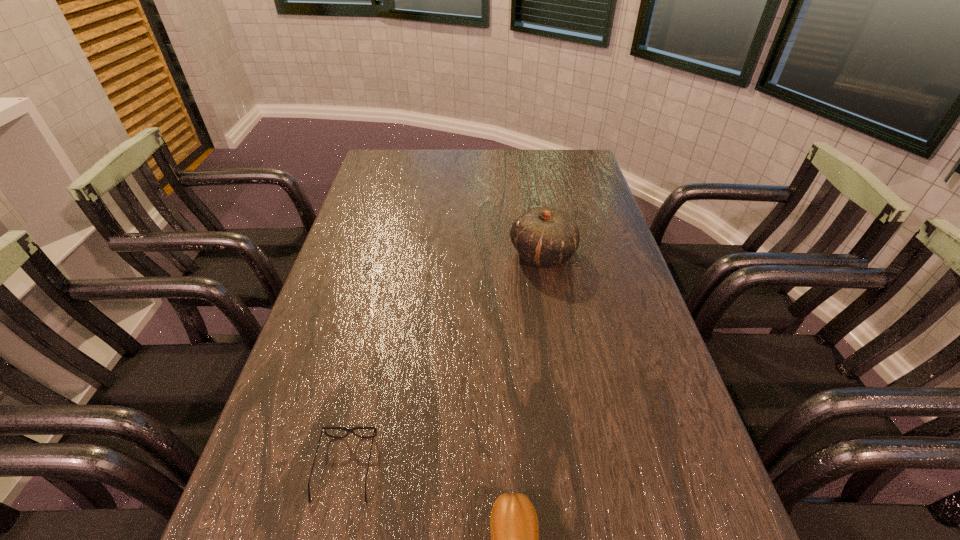
Identify the location of vacant space at the far left corner of the desktop. Image resolution: width=960 pixels, height=540 pixels. (375, 176).

At what (x,y) coordinates should I click in order to perform the action: click on free location at the far right corner of the desktop. Please return your answer as a coordinate pair (x, y). This screenshot has height=540, width=960. Looking at the image, I should click on (581, 160).

I want to click on vacant space that is in between the taller gourd and the second farthest object, so click(444, 362).

At what (x,y) coordinates should I click in order to perform the action: click on vacant point located between the spectacles and the farther gourd. Please return your answer as a coordinate pair (x, y). Looking at the image, I should click on (444, 362).

Find the location of a particular element. The height and width of the screenshot is (540, 960). vacant area that lies between the second nearest object and the taller gourd is located at coordinates (444, 362).

Where is `empty space between the farther gourd and the spectacles`? The image size is (960, 540). empty space between the farther gourd and the spectacles is located at coordinates (444, 362).

At what (x,y) coordinates should I click in order to perform the action: click on blank region between the tallest object and the leftmost object. Please return your answer as a coordinate pair (x, y). Looking at the image, I should click on (444, 362).

You are a GUI agent. You are given a task and a screenshot of the screen. Output one action in this format:
    pyautogui.click(x=<x>, y=<y>)
    Task: Click on the object that is the closest to the farthest object
    
    Given the screenshot: What is the action you would take?
    pyautogui.click(x=374, y=429)

Where is `the closest object relative to the farther gourd`? The height and width of the screenshot is (540, 960). the closest object relative to the farther gourd is located at coordinates (374, 429).